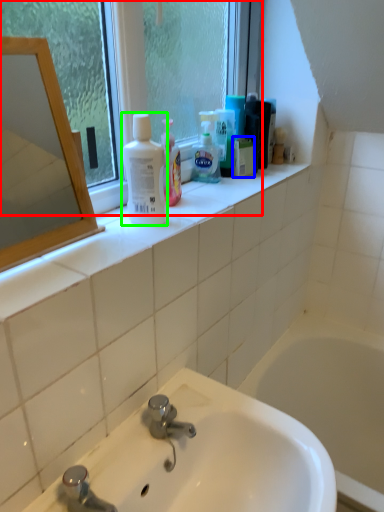
Question: Considering the real-world distances, which object is closest to window (highlighted by a red box)? mouthwash (highlighted by a blue box) or cleaning product (highlighted by a green box).

Choices:
 (A) mouthwash
 (B) cleaning product

Answer: (B)